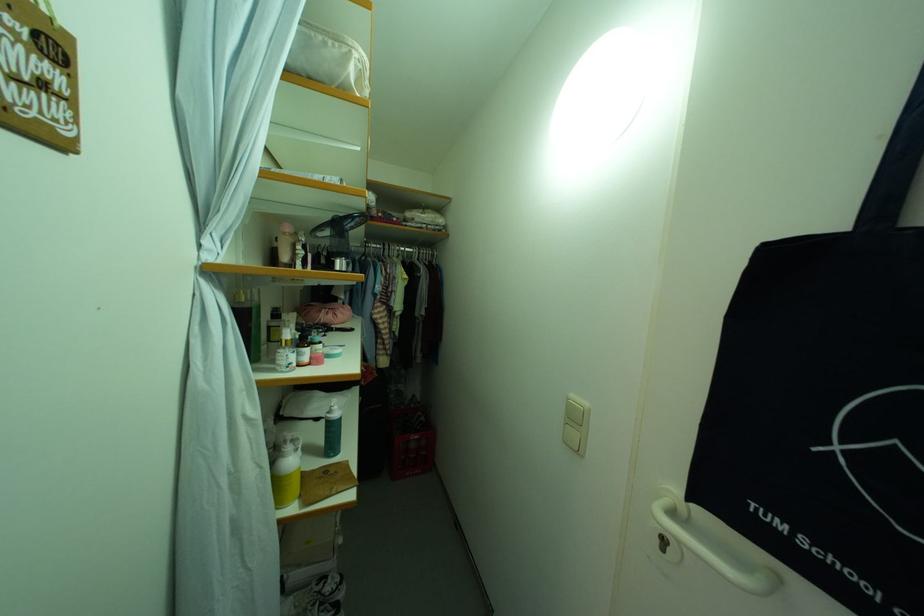
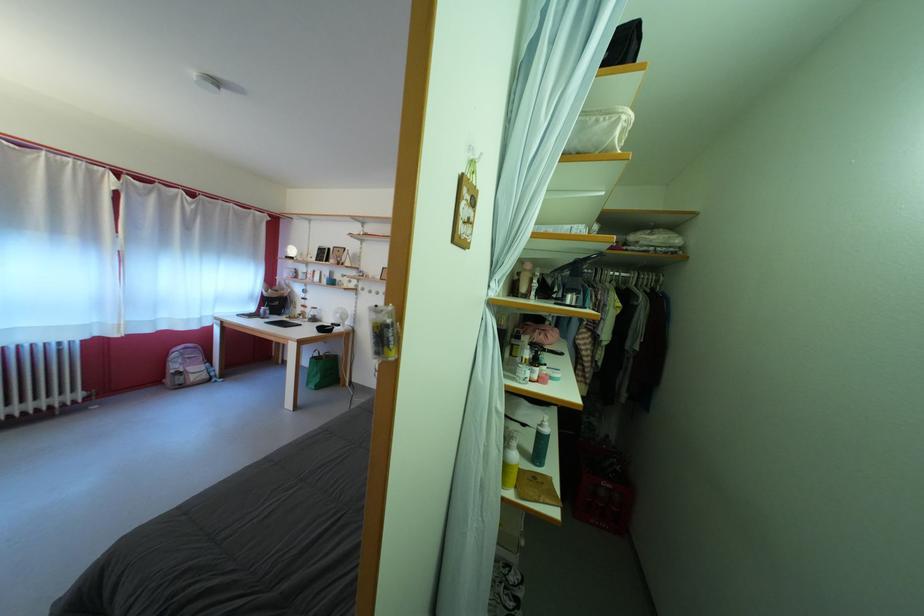
Locate, in the second image, the point that corresponds to (x=314, y=366) in the first image.

(543, 383)